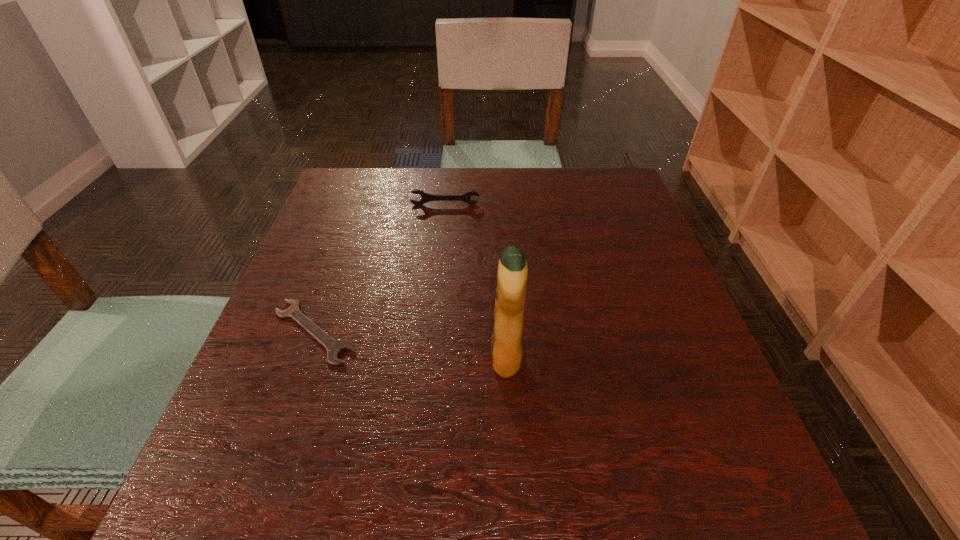
Where is `free space between the nearer wrench and the tallest object`? free space between the nearer wrench and the tallest object is located at coordinates (411, 345).

You are a GUI agent. You are given a task and a screenshot of the screen. Output one action in this format:
    pyautogui.click(x=<x>, y=<y>)
    Task: Click on the free space that is in between the rightmost object and the left wrench
    Image resolution: width=960 pixels, height=540 pixels.
    Given the screenshot: What is the action you would take?
    pyautogui.click(x=411, y=345)

Identify the location of vacant region between the second tallest object and the shorter wrench. Image resolution: width=960 pixels, height=540 pixels. (380, 268).

Identify the location of free spot between the farthest object and the shorter wrench. (380, 268).

This screenshot has height=540, width=960. What are the coordinates of `vacant space that is in between the detergent and the taller wrench` in the screenshot? It's located at (476, 281).

Where is `empty space that is in between the farthest object and the rightmost object`? empty space that is in between the farthest object and the rightmost object is located at coordinates (476, 281).

Locate an element on the screen. This screenshot has width=960, height=540. free spot between the rightmost object and the leftmost object is located at coordinates (411, 345).

This screenshot has height=540, width=960. What are the coordinates of `vacant space that's between the right wrench and the left wrench` in the screenshot? It's located at (380, 268).

Select which object appears as the second closest to the farther wrench. Please provide its 2D coordinates. Your answer should be formatted as a tuple, i.e. [(x, y)], where the tuple contains the x and y coordinates of a point satisfying the conditions above.

[(506, 344)]

Identify the location of object that is the second closest to the rightmost object. This screenshot has width=960, height=540. (425, 197).